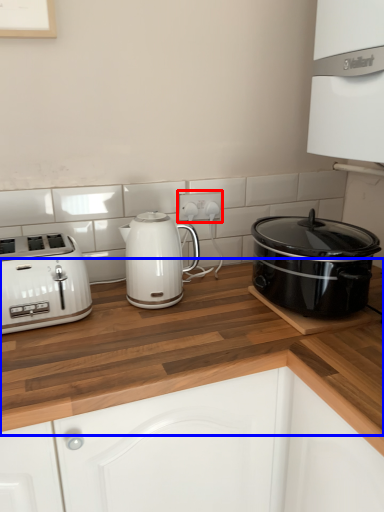
Question: Which point is further to the camera, electric outlet (highlighted by a red box) or counter top (highlighted by a blue box)?

Choices:
 (A) electric outlet
 (B) counter top

Answer: (A)